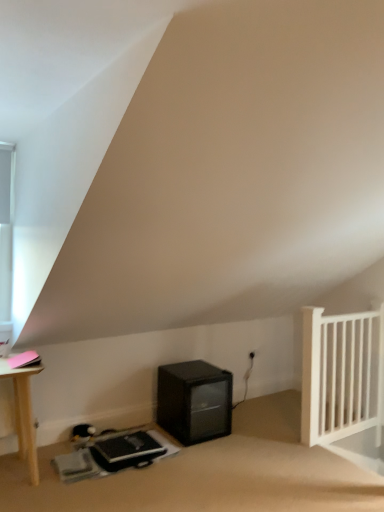
Image resolution: width=384 pixels, height=512 pixels. I want to click on white wooden radiator at right, so click(x=341, y=374).

Measure the distance between white glass window at upper left and camera.

white glass window at upper left is 9.73 feet from camera.

At what (x,y) coordinates should I click in order to perform the action: click on white wooden radiator at right. Please return your answer as a coordinate pair (x, y). Looking at the image, I should click on (341, 374).

Is white wooden radiator at right next to black matte mini-fridge at lower center and touching it?

No, white wooden radiator at right is not in contact with black matte mini-fridge at lower center.

From a real-world perspective, is white wooden radiator at right physically below black matte mini-fridge at lower center?

No, from a real-world perspective, white wooden radiator at right is not below black matte mini-fridge at lower center.

Is white wooden radiator at right shorter than black matte mini-fridge at lower center?

No, white wooden radiator at right is not shorter than black matte mini-fridge at lower center.

Which of these two, white wooden radiator at right or black matte mini-fridge at lower center, is wider?

With larger width is black matte mini-fridge at lower center.

From the picture: Is black matte mini-fridge at lower center to the left or to the right of white wooden radiator at right in the image?

Based on their positions, black matte mini-fridge at lower center is located to the left of white wooden radiator at right.

Is black matte mini-fridge at lower center bigger or smaller than white wooden radiator at right?

black matte mini-fridge at lower center is smaller than white wooden radiator at right.

Choose the correct answer: Is black matte mini-fridge at lower center inside white wooden radiator at right or outside it?

black matte mini-fridge at lower center is not enclosed by white wooden radiator at right.

From the image's perspective, is black matte mini-fridge at lower center under white wooden radiator at right?

Yes, from the image's perspective, black matte mini-fridge at lower center is below white wooden radiator at right.

Which object is closer to the camera taking this photo, white wooden radiator at right or white glass window at upper left?

white glass window at upper left is closer to the camera.

Are white wooden radiator at right and white glass window at upper left making contact?

No, white wooden radiator at right is not beside white glass window at upper left.

Considering the relative positions of white wooden radiator at right and white glass window at upper left in the image provided, is white wooden radiator at right to the right of white glass window at upper left from the viewer's perspective?

Indeed, white wooden radiator at right is positioned on the right side of white glass window at upper left.

Is black matte mini-fridge at lower center not inside white glass window at upper left?

Yes, black matte mini-fridge at lower center is located beyond the bounds of white glass window at upper left.

From the image's perspective, relative to white glass window at upper left, is black matte mini-fridge at lower center above or below?

From the image's perspective, black matte mini-fridge at lower center appears below white glass window at upper left.

You are a GUI agent. You are given a task and a screenshot of the screen. Output one action in this format:
    pyautogui.click(x=<x>, y=<y>)
    Task: Click on the window on the left of black matte mini-fridge at lower center
    Image resolution: width=384 pixels, height=512 pixels.
    Given the screenshot: What is the action you would take?
    pyautogui.click(x=6, y=237)

Is black matte mini-fridge at lower center turned away from white glass window at upper left?

No, black matte mini-fridge at lower center is not facing away from white glass window at upper left.

This screenshot has height=512, width=384. Identify the location of appliance below the white glass window at upper left (from a real-world perspective). (194, 401).

Does white glass window at upper left touch black matte mini-fridge at lower center?

white glass window at upper left and black matte mini-fridge at lower center are not in contact.

From the image's perspective, does white glass window at upper left appear lower than black matte mini-fridge at lower center?

No, from the image's perspective, white glass window at upper left is not below black matte mini-fridge at lower center.

From a real-world perspective, is white glass window at upper left located higher than black matte mini-fridge at lower center?

Yes, from a real-world perspective, white glass window at upper left is over black matte mini-fridge at lower center

Is white glass window at upper left with white wooden radiator at right?

No, white glass window at upper left is not in contact with white wooden radiator at right.

Does white glass window at upper left come behind white wooden radiator at right?

No.

Based on the photo, does white glass window at upper left appear on the right side of white wooden radiator at right?

No.

From a real-world perspective, which is physically below, white glass window at upper left or white wooden radiator at right?

white wooden radiator at right, from a real-world perspective.

Find the location of a particular element. radiator located above the black matte mini-fridge at lower center (from a real-world perspective) is located at coordinates (341, 374).

I want to click on radiator behind the black matte mini-fridge at lower center, so click(341, 374).

Based on their spatial positions, is black matte mini-fridge at lower center or white glass window at upper left further from white wooden radiator at right?

Among the two, white glass window at upper left is located further to white wooden radiator at right.

Consider the image. Which object lies further to the anchor point white glass window at upper left, black matte mini-fridge at lower center or white wooden radiator at right?

The object further to white glass window at upper left is white wooden radiator at right.

Considering their positions, is white glass window at upper left positioned further to black matte mini-fridge at lower center than white wooden radiator at right?

Among the two, white glass window at upper left is located further to black matte mini-fridge at lower center.

When comparing their distances from black matte mini-fridge at lower center, does white wooden radiator at right or white glass window at upper left seem closer?

white wooden radiator at right lies closer to black matte mini-fridge at lower center than the other object.

Based on their spatial positions, is white wooden radiator at right or black matte mini-fridge at lower center further from white glass window at upper left?

The object further to white glass window at upper left is white wooden radiator at right.

Looking at this image, looking at the image, which one is located further to white wooden radiator at right, white glass window at upper left or black matte mini-fridge at lower center?

white glass window at upper left is further to white wooden radiator at right.

I want to click on appliance between white glass window at upper left and white wooden radiator at right, so click(x=194, y=401).